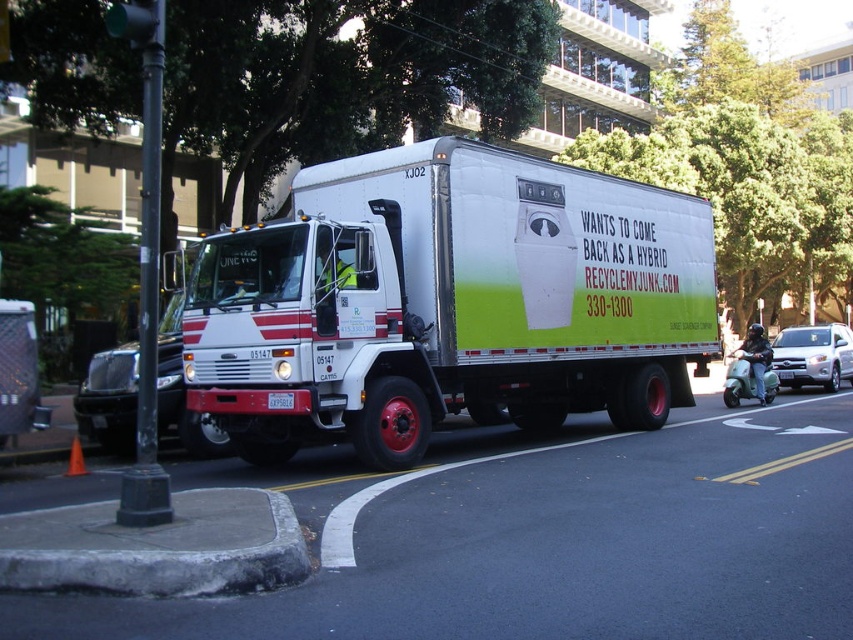
You are a pedestrian standing on the sidewalk and see the silver metallic suv at right and the white plastic license plate at center. Which object is positioned lower in the image?

The silver metallic suv at right is located below the white plastic license plate at center, so it is positioned lower in the image.

You are a pedestrian standing on the sidewalk and see the white matte truck at center and the silver metallic suv at right. Which vehicle is positioned higher from the ground?

The white matte truck at center is positioned higher from the ground than the silver metallic suv at right because it is above it.

From the picture: You are a delivery driver who needs to park your white matte truck at center as close as possible to the gray concrete curb at lower left without going over the curb. Given that the parking space is only 4 meters long, can you safely park the truck within the space?

The white matte truck at center is 4.04 meters from the gray concrete curb at lower left. Since the parking space is only 4 meters long, the truck is slightly longer than the available space, so it cannot be parked safely within the 4 meter limit without overhanging.